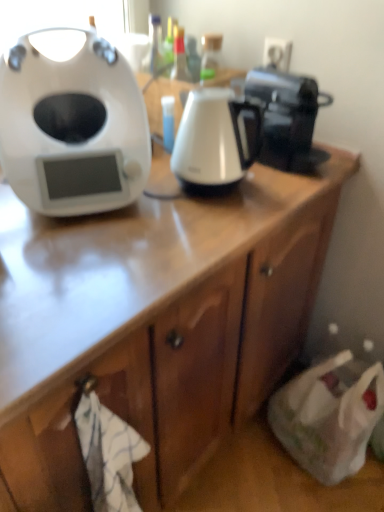
The image size is (384, 512). Find the location of `free location above white glossy electric kettle at center (from a real-world perspective)`. free location above white glossy electric kettle at center (from a real-world perspective) is located at coordinates (212, 101).